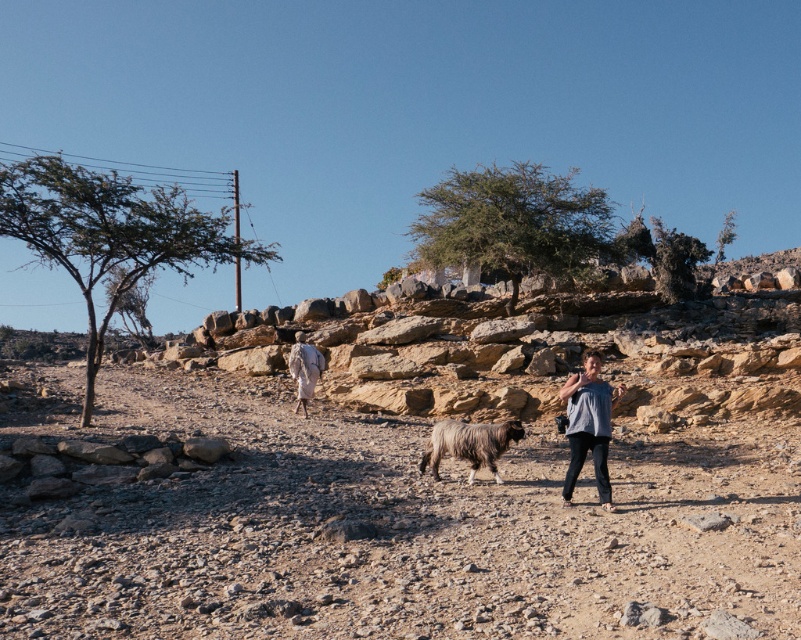
Question: Is gray cotton shirt at center further to the viewer compared to dark brown woolly sheep at center?

Choices:
 (A) no
 (B) yes

Answer: (A)

Question: Can you confirm if gray cotton shirt at center is bigger than green leafy tree at upper center?

Choices:
 (A) yes
 (B) no

Answer: (B)

Question: Which of the following is the closest to the observer?

Choices:
 (A) green leafy tree at center
 (B) gray cotton shirt at center

Answer: (B)

Question: Which object is closer to the camera taking this photo?

Choices:
 (A) green leafy tree at center
 (B) green leafy tree at upper center
 (C) gray cotton shirt at center

Answer: (C)

Question: Considering the real-world distances, which object is closest to the green leafy tree at upper right?

Choices:
 (A) green leafy tree at center
 (B) green leafy tree at left
 (C) white cloth at center
 (D) gray cotton shirt at center

Answer: (A)

Question: Is green leafy tree at left below gray cotton shirt at center?

Choices:
 (A) yes
 (B) no

Answer: (B)